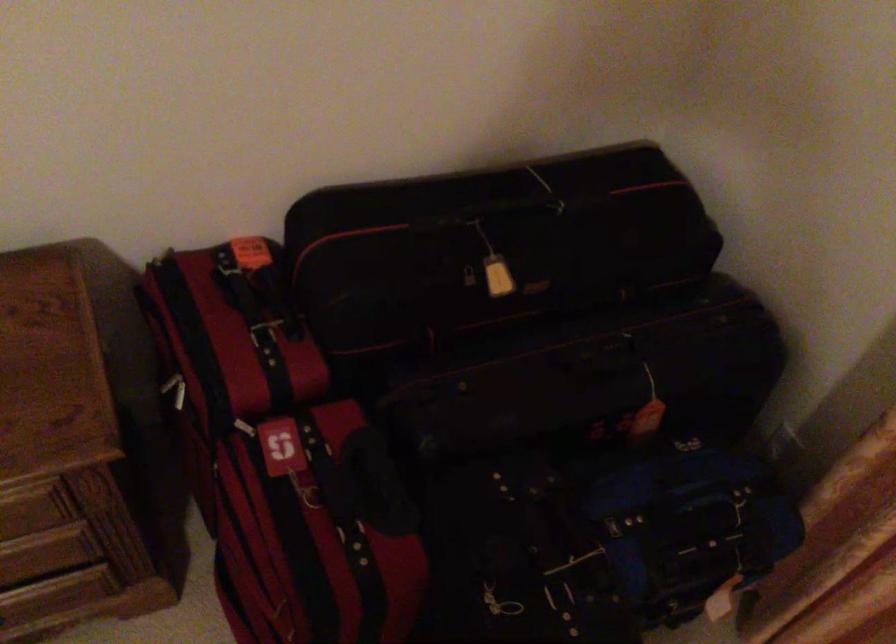
Where is `silver zipper pull`? silver zipper pull is located at coordinates (470, 287).